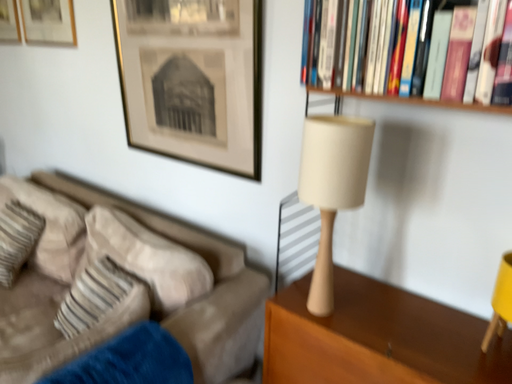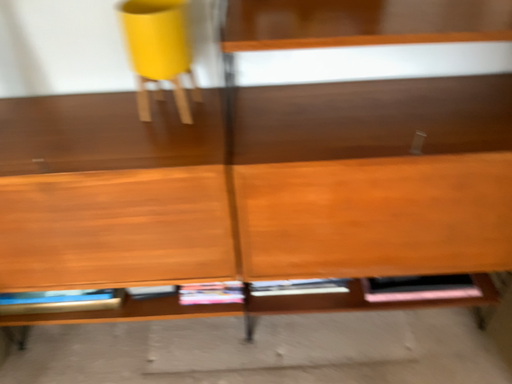
Question: How did the camera likely rotate when shooting the video?

Choices:
 (A) rotated upward
 (B) rotated downward

Answer: (B)